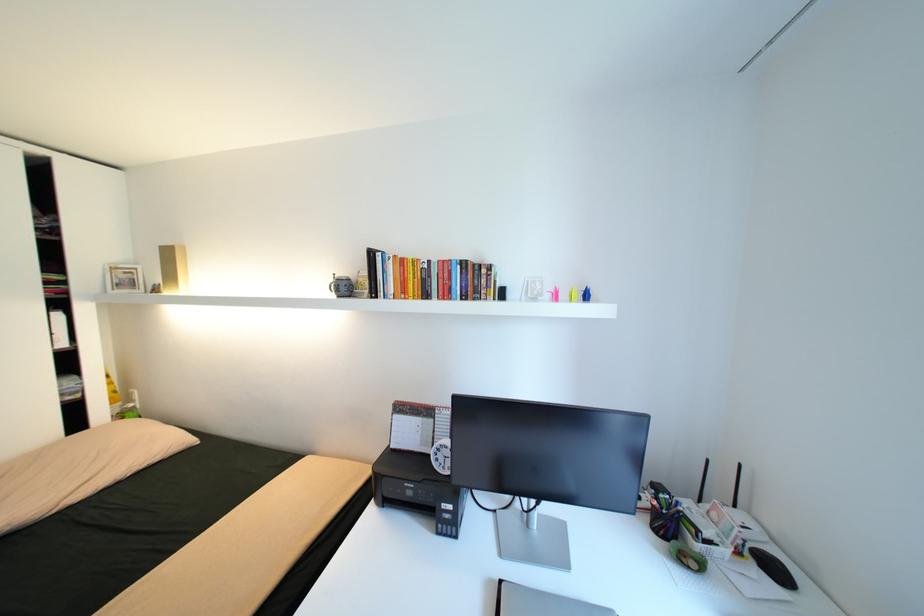
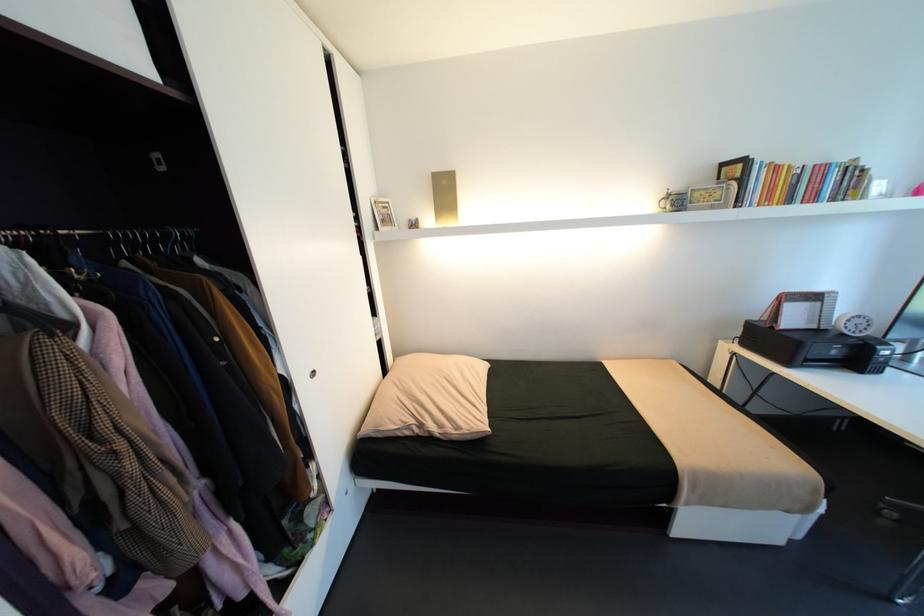
Where in the second image is the point corresponding to (131,273) from the first image?

(392, 208)